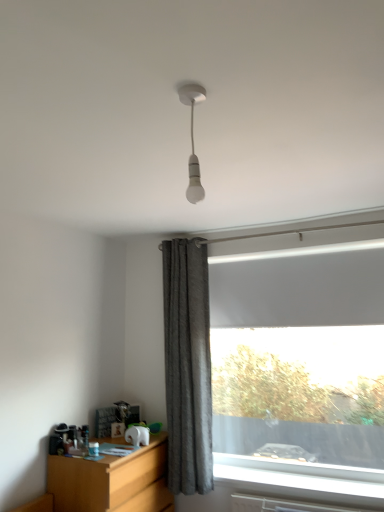
Question: Is wooden at left positioned with its back to gray textured curtain at center?

Choices:
 (A) no
 (B) yes

Answer: (A)

Question: Considering the relative positions of wooden at left and gray textured curtain at center in the image provided, is wooden at left in front of gray textured curtain at center?

Choices:
 (A) no
 (B) yes

Answer: (B)

Question: Is gray textured curtain at center located within wooden at left?

Choices:
 (A) yes
 (B) no

Answer: (B)

Question: From the image's perspective, is wooden at left below gray textured curtain at center?

Choices:
 (A) no
 (B) yes

Answer: (B)

Question: Is wooden at left in contact with gray textured curtain at center?

Choices:
 (A) no
 (B) yes

Answer: (A)

Question: Based on their sizes in the image, would you say gray textured curtain at center is bigger or smaller than wooden at left?

Choices:
 (A) small
 (B) big

Answer: (A)

Question: Is gray textured curtain at center to the left or to the right of wooden at left in the image?

Choices:
 (A) left
 (B) right

Answer: (B)

Question: From a real-world perspective, is gray textured curtain at center positioned above or below wooden at left?

Choices:
 (A) above
 (B) below

Answer: (A)

Question: Which is correct: gray textured curtain at center is inside wooden at left, or outside of it?

Choices:
 (A) outside
 (B) inside

Answer: (A)

Question: In the image, is white matte bulb at upper center on the left side or the right side of gray textured curtain at center?

Choices:
 (A) left
 (B) right

Answer: (B)

Question: Considering the positions of white matte bulb at upper center and gray textured curtain at center in the image, is white matte bulb at upper center bigger or smaller than gray textured curtain at center?

Choices:
 (A) small
 (B) big

Answer: (A)

Question: Is point (193, 201) positioned closer to the camera than point (183, 244)?

Choices:
 (A) farther
 (B) closer

Answer: (B)

Question: In terms of width, does white matte bulb at upper center look wider or thinner when compared to gray textured curtain at center?

Choices:
 (A) thin
 (B) wide

Answer: (A)

Question: Considering the positions of point (97, 485) and point (178, 96), is point (97, 485) closer or farther from the camera than point (178, 96)?

Choices:
 (A) farther
 (B) closer

Answer: (A)

Question: Is wooden at left taller or shorter than white matte bulb at upper center?

Choices:
 (A) tall
 (B) short

Answer: (A)